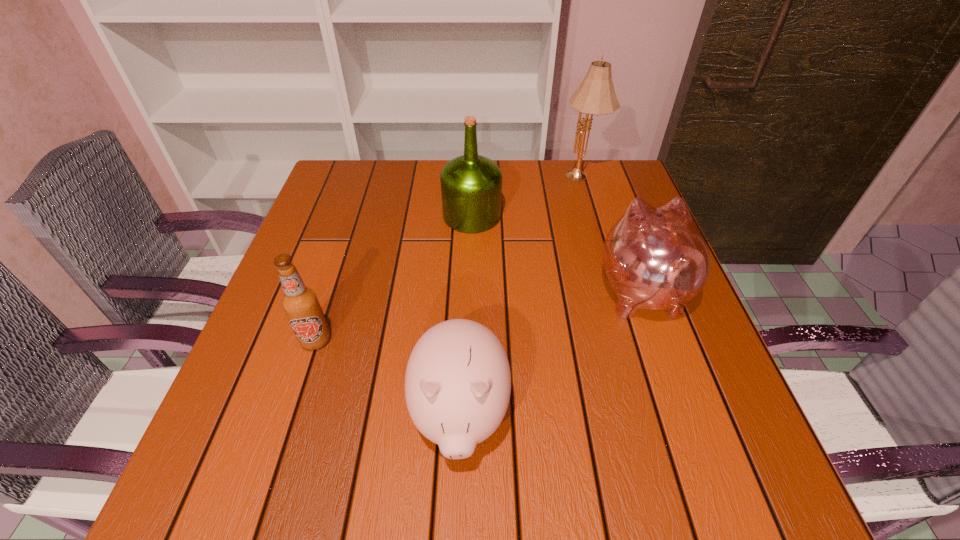
The width and height of the screenshot is (960, 540). Find the location of `the farthest object`. the farthest object is located at coordinates (596, 95).

Where is `the tallest object`? The width and height of the screenshot is (960, 540). the tallest object is located at coordinates (596, 95).

Locate an element on the screen. This screenshot has width=960, height=540. the second farthest object is located at coordinates (471, 185).

I want to click on the second tallest object, so click(471, 185).

In order to click on beer bottle in this screenshot , I will do `click(300, 303)`.

The image size is (960, 540). Identify the location of the farther piggy bank. (655, 258).

Find the location of a particular element. This screenshot has width=960, height=540. the left piggy bank is located at coordinates (458, 382).

Locate an element on the screen. This screenshot has height=540, width=960. the nearest object is located at coordinates (458, 382).

Locate an element on the screen. The image size is (960, 540). free location located 0.340m on the left of the tallest object is located at coordinates (441, 177).

Where is `free region located on the left of the second tallest object`? The image size is (960, 540). free region located on the left of the second tallest object is located at coordinates (354, 215).